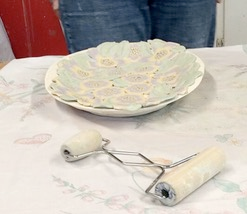
Identify the location of shallow bowl. (195, 83).